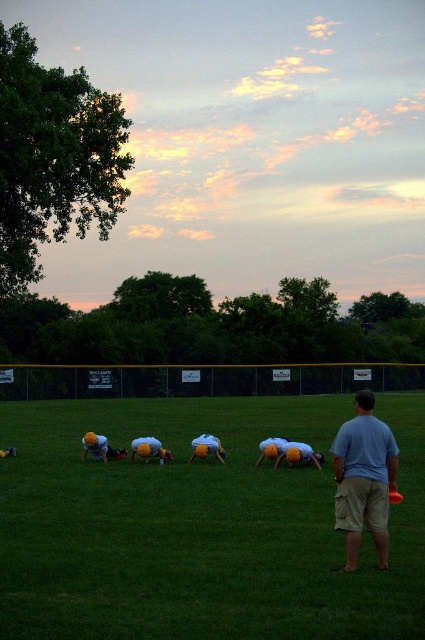
Question: Which is nearer to the green grass at center?

Choices:
 (A) yellow fabric helmet at center
 (B) yellow fabric helmet at lower left
 (C) orange plastic frisbee at center

Answer: (A)

Question: Is light blue t-shirt at center bigger than yellow fabric shirt at center?

Choices:
 (A) yes
 (B) no

Answer: (A)

Question: Based on their relative distances, which object is farther from the yellow fabric helmet at lower left?

Choices:
 (A) light blue t-shirt at center
 (B) yellow fabric at center
 (C) orange plastic frisbee at center
 (D) green grass at center

Answer: (D)

Question: Is yellow fabric helmet at lower left behind orange plastic frisbee at center?

Choices:
 (A) no
 (B) yes

Answer: (B)

Question: Which point is farther from the camera taking this photo?

Choices:
 (A) (399, 499)
 (B) (201, 449)

Answer: (B)

Question: Is light blue t-shirt at center bigger than yellow fabric at center?

Choices:
 (A) yes
 (B) no

Answer: (A)